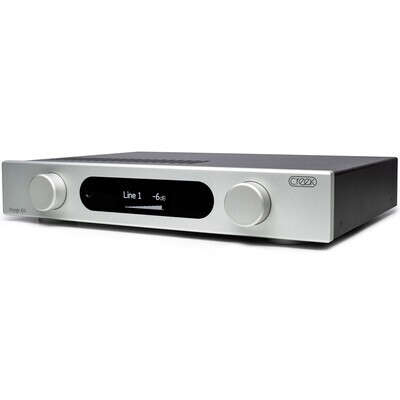
Identify the location of device vents. The width and height of the screenshot is (400, 400). (125, 157).